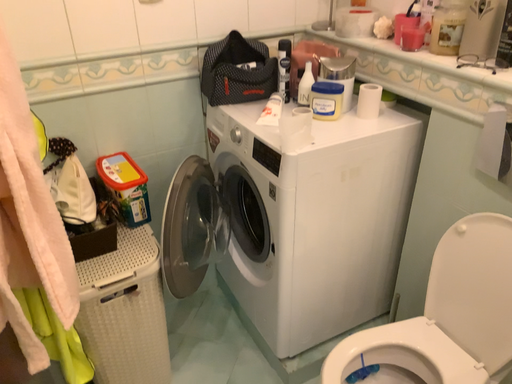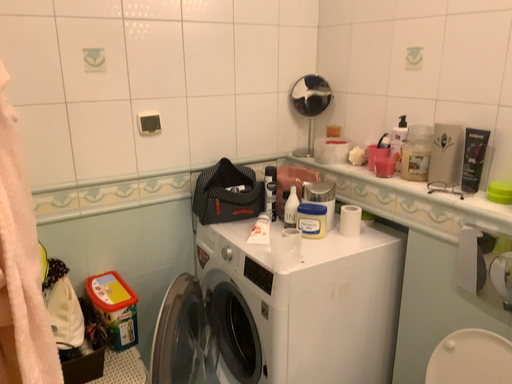
Question: How did the camera likely rotate when shooting the video?

Choices:
 (A) rotated upward
 (B) rotated downward

Answer: (A)